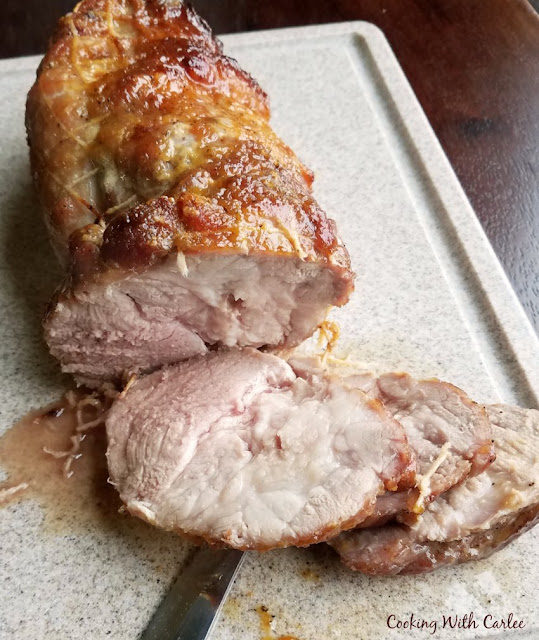
I want to click on gray cutting board of some type of stone, so coord(331,106), coord(411,166).